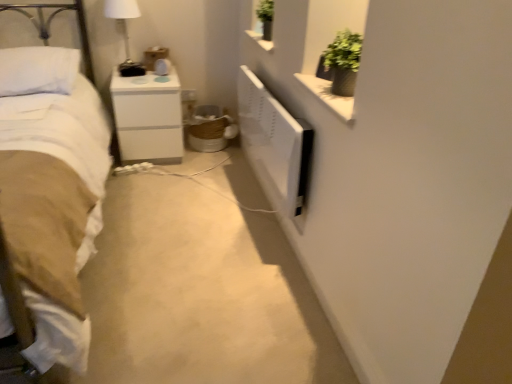
Question: From their relative heights in the image, would you say white soft bed at left is taller or shorter than white glossy lampshade at upper left?

Choices:
 (A) tall
 (B) short

Answer: (A)

Question: From the image's perspective, relative to white glossy lampshade at upper left, is white soft bed at left above or below?

Choices:
 (A) above
 (B) below

Answer: (B)

Question: Considering the real-world distances, which object is closest to the white soft pillow at upper left?

Choices:
 (A) white glossy lampshade at upper left
 (B) white soft bed at left
 (C) white glossy nightstand at center

Answer: (B)

Question: Which of these objects is positioned farthest from the white glossy nightstand at center?

Choices:
 (A) white soft bed at left
 (B) white glossy lampshade at upper left
 (C) white soft pillow at upper left

Answer: (A)